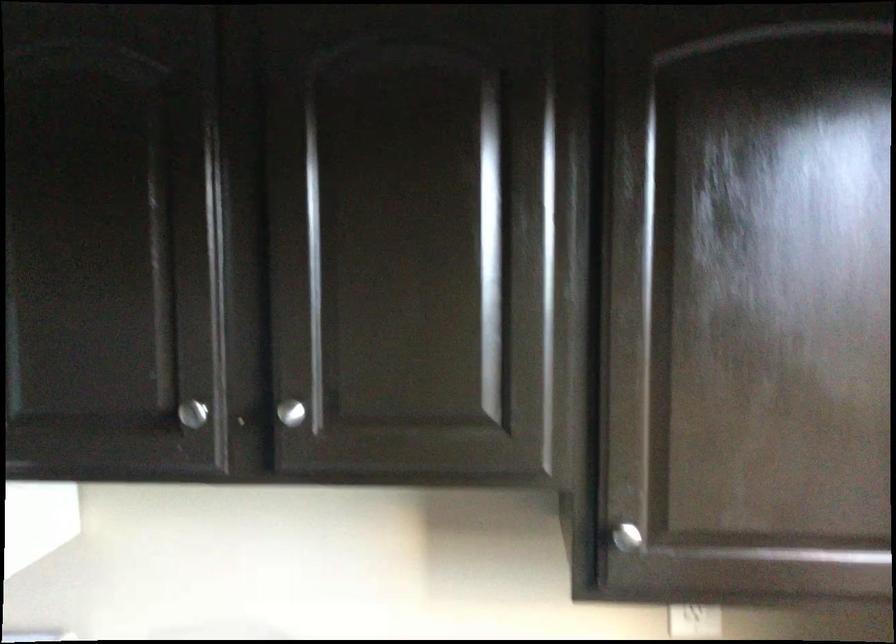
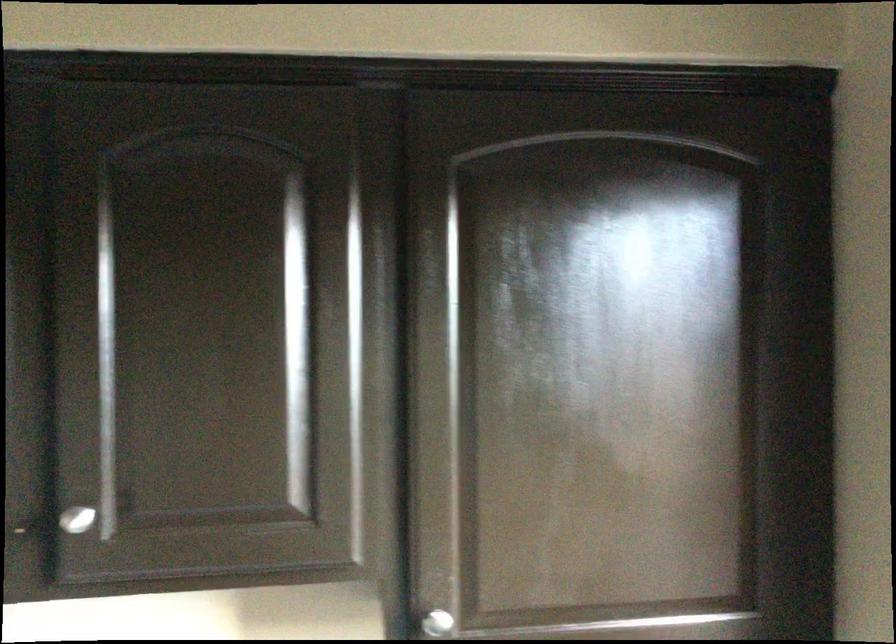
Question: The first image is from the beginning of the video and the second image is from the end. How did the camera likely rotate when shooting the video?

Choices:
 (A) Left
 (B) Right
 (C) Up
 (D) Down

Answer: (B)